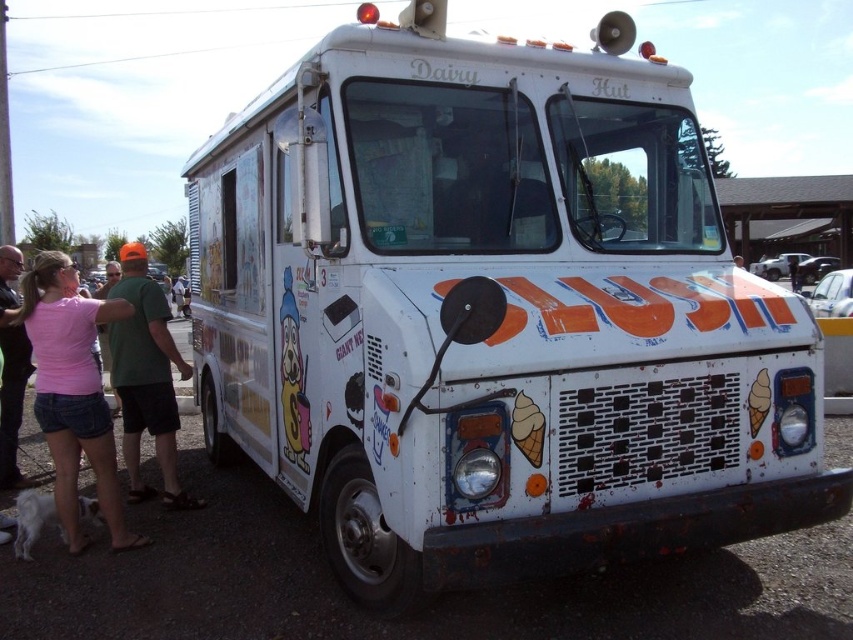
Question: Considering the relative positions of pink fabric shirt at lower left and white fur dog at lower left in the image provided, where is pink fabric shirt at lower left located with respect to white fur dog at lower left?

Choices:
 (A) left
 (B) right

Answer: (B)

Question: Is green fabric shirt at left positioned at the back of white fur dog at lower left?

Choices:
 (A) yes
 (B) no

Answer: (A)

Question: Which point is closer to the camera taking this photo?

Choices:
 (A) (62, 536)
 (B) (9, 484)
 (C) (36, 282)

Answer: (C)

Question: Does pink fabric shirt at lower left have a lesser width compared to pink fabric shirt at left?

Choices:
 (A) yes
 (B) no

Answer: (B)

Question: Which point is farther to the camera?

Choices:
 (A) (36, 518)
 (B) (18, 483)

Answer: (B)

Question: Which of these objects is positioned farthest from the white fur dog at lower left?

Choices:
 (A) pink fabric shirt at lower left
 (B) green fabric shirt at left
 (C) pink fabric shirt at left

Answer: (C)